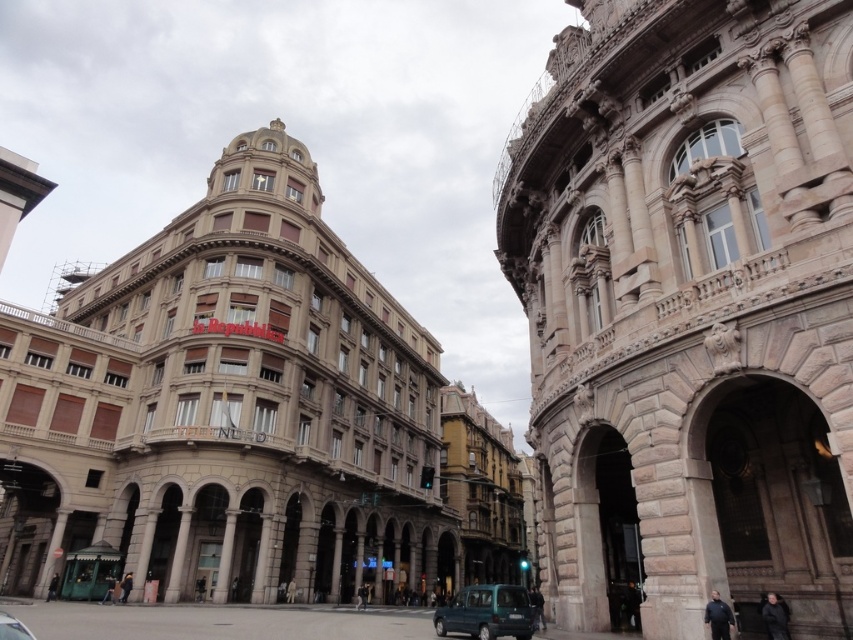
You are a delivery person needing to park your 1.8 meter wide van in this urban scene. You see the teal matte car at lower center and the metallic silver car at lower left. Which parking spot between these two cars can accommodate your van?

The metallic silver car at lower left has a greater width than the teal matte car at lower center. Since your van is 1.8 meters wide, you should check the parking spot next to the metallic silver car at lower left as it might have more space. However, without knowing the exact width of the cars, it is uncertain if it will fit.

You are a pedestrian standing at the crosswalk in front of the teal matte car at lower center and the metallic silver car at lower left. Which car is closer to the crosswalk?

The teal matte car at lower center is closer to the crosswalk because it is located below the metallic silver car at lower left, indicating it is positioned further away from the pedestrian.

You are a delivery person needing to park your vehicle in a low clearance garage that allows a maximum height of 1.8 meters. You see the teal matte car at lower center and the metallic silver car at lower left in the parking area. Which car should you avoid parking next to to ensure your vehicle fits under the garage entrance?

You should avoid parking next to the teal matte car at lower center because it is taller than the metallic silver car at lower left, indicating it might exceed the 1.8 meter height limit.